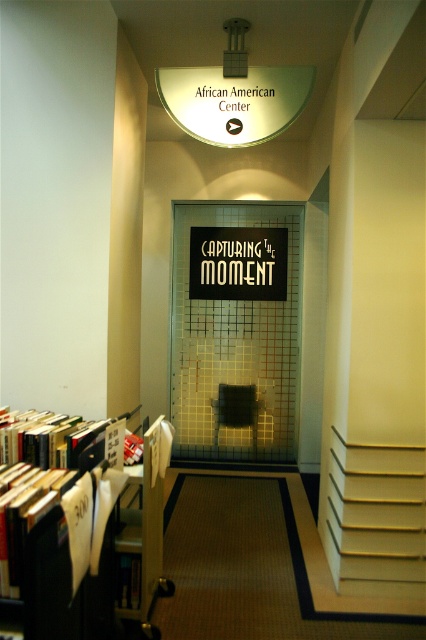
You are standing at the entrance of the African American Center and see two points marked in the scene. Which point, point (103, 474) or point (138, 598), is closer to you?

Point (103, 474) is closer to you than point (138, 598).

You are standing at the entrance of the African American Center and notice two signs. The first is the matte glass sign at upper center and the second is the black matte sign at center. Which sign is positioned to the left when facing the entrance?

The matte glass sign at upper center is positioned to the left of the black matte sign at center when facing the entrance.